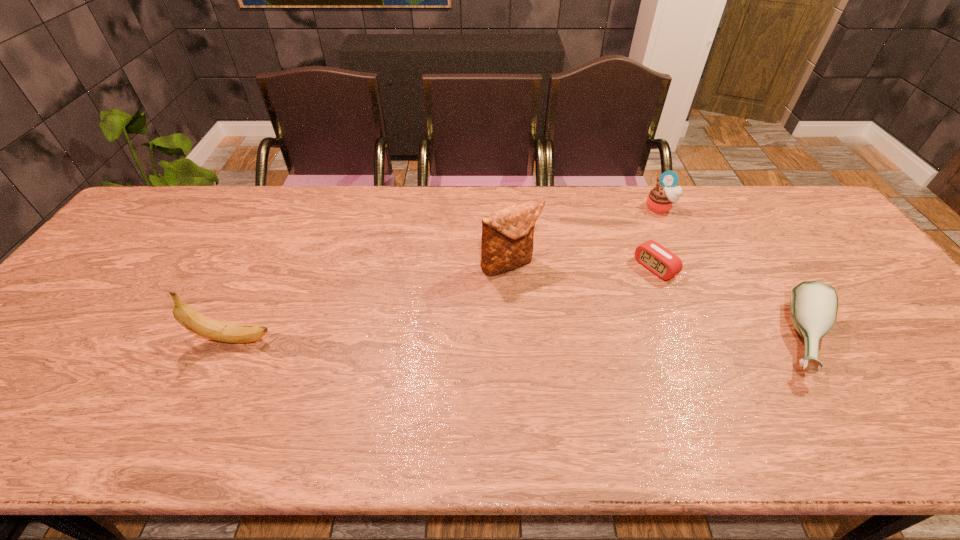
The height and width of the screenshot is (540, 960). In order to click on the leftmost object in this screenshot , I will do `click(188, 317)`.

Where is `bottle`? bottle is located at coordinates (813, 304).

Where is `the rightmost object`? This screenshot has height=540, width=960. the rightmost object is located at coordinates (813, 304).

At what (x,y) coordinates should I click in order to perform the action: click on clutch bag. Please return your answer as a coordinate pair (x, y). This screenshot has height=540, width=960. Looking at the image, I should click on (507, 234).

This screenshot has width=960, height=540. I want to click on the shortest object, so click(x=663, y=263).

Identify the location of muffin. (661, 199).

Where is `the farthest object`? This screenshot has height=540, width=960. the farthest object is located at coordinates (661, 199).

Where is `vacant area situated at the start of the peel on the leftmost object`? The width and height of the screenshot is (960, 540). vacant area situated at the start of the peel on the leftmost object is located at coordinates (324, 339).

Locate an element on the screen. This screenshot has height=540, width=960. vacant area situated 0.290m on the left of the bottle is located at coordinates click(x=651, y=340).

At what (x,y) coordinates should I click in order to perform the action: click on free space located 0.270m on the open side of the clutch bag. Please return your answer as a coordinate pair (x, y). Looking at the image, I should click on click(x=573, y=354).